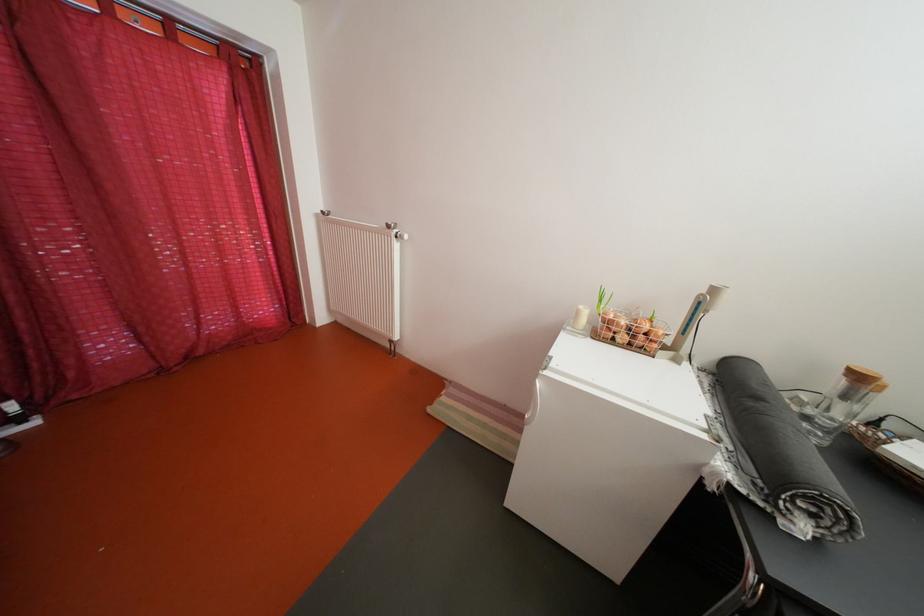
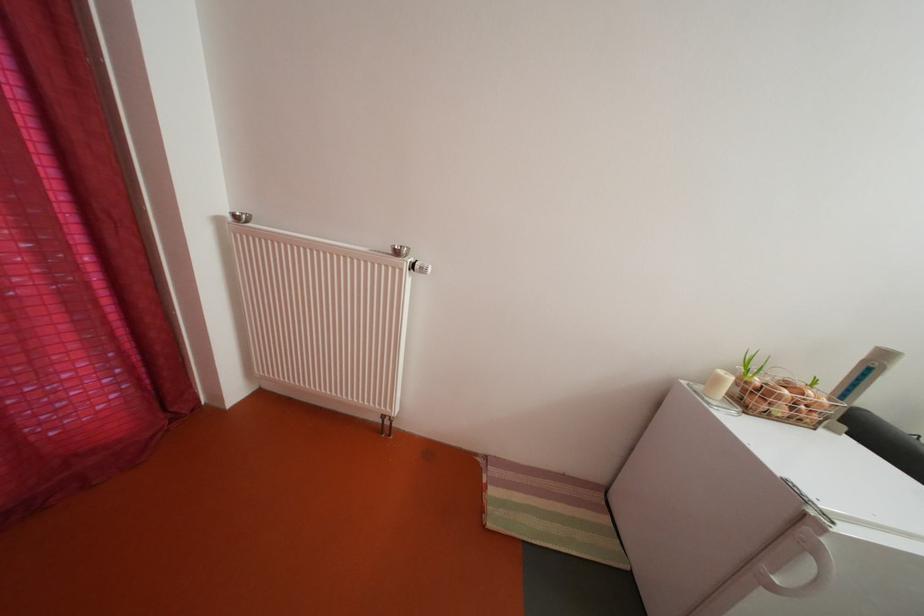
Locate, in the second image, the point that corresponds to [635,345] in the first image.

(792, 416)